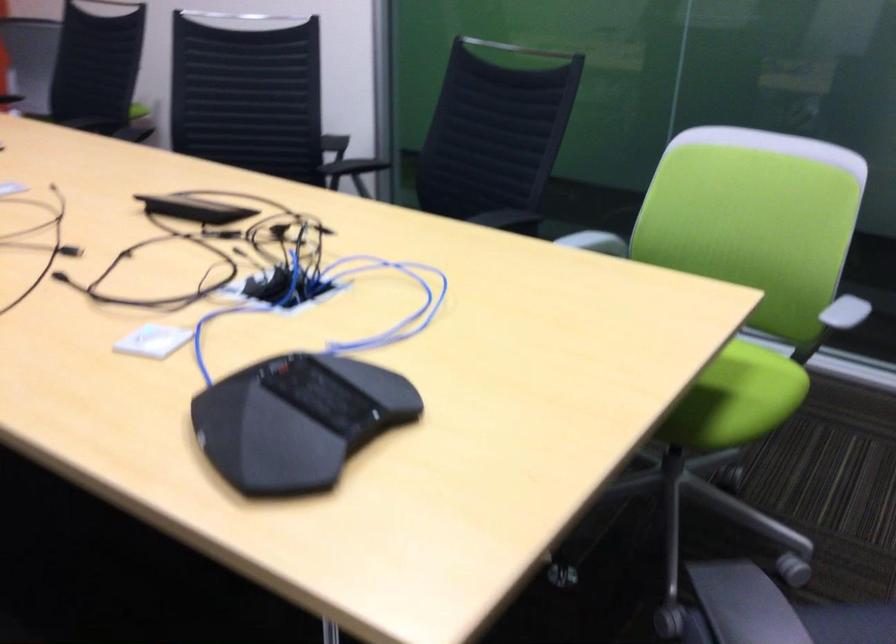
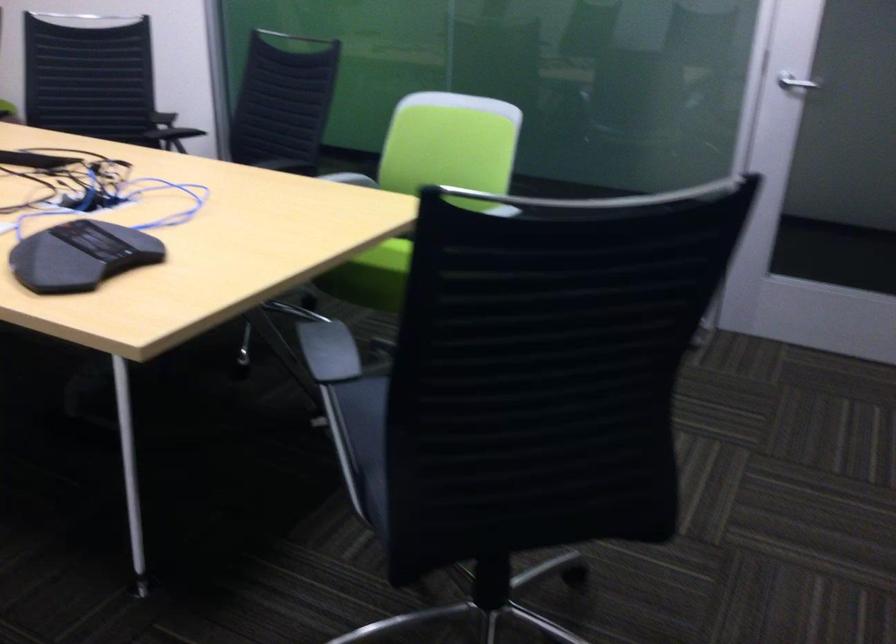
The images are taken continuously from a first-person perspective. In which direction are you moving?

The cameraman walked toward right, backward.